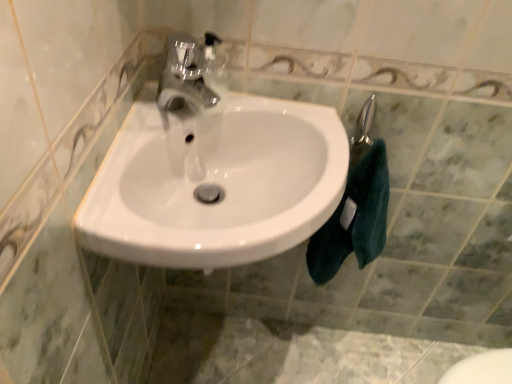
What is the approximate width of white glossy sink at center?

The width of white glossy sink at center is 16.95 inches.

The height and width of the screenshot is (384, 512). Find the location of `white glossy sink at center`. white glossy sink at center is located at coordinates (213, 172).

In order to face white glossy sink at center, should I rotate leftwards or rightwards?

Turn left by 2.709 degrees to look at white glossy sink at center.

The height and width of the screenshot is (384, 512). What do you see at coordinates (213, 172) in the screenshot?
I see `white glossy sink at center` at bounding box center [213, 172].

What do you see at coordinates (354, 218) in the screenshot? The width and height of the screenshot is (512, 384). I see `dark teal towel at right` at bounding box center [354, 218].

In order to click on dark teal towel at right in this screenshot , I will do `click(354, 218)`.

Find the location of a particular element. The width and height of the screenshot is (512, 384). white glossy sink at center is located at coordinates (213, 172).

Which is more to the left, dark teal towel at right or white glossy sink at center?

white glossy sink at center is more to the left.

Based on the photo, relative to white glossy sink at center, is dark teal towel at right in front or behind?

Visually, dark teal towel at right is located behind white glossy sink at center.

Between point (356, 211) and point (172, 115), which one is positioned in front?

The point (172, 115) is in front.

From the image's perspective, is dark teal towel at right on white glossy sink at center?

No, from the image's perspective, dark teal towel at right is not over white glossy sink at center.

From a real-world perspective, who is located lower, dark teal towel at right or white glossy sink at center?

In real-world perspective, dark teal towel at right is lower.

Which object is thinner, dark teal towel at right or white glossy sink at center?

dark teal towel at right.

Can you confirm if dark teal towel at right is taller than white glossy sink at center?

Yes, dark teal towel at right is taller than white glossy sink at center.

Which of these two, dark teal towel at right or white glossy sink at center, is bigger?

With larger size is white glossy sink at center.

Is dark teal towel at right completely or partially outside of white glossy sink at center?

→ Yes, dark teal towel at right is outside of white glossy sink at center.

Are dark teal towel at right and white glossy sink at center beside each other?

dark teal towel at right and white glossy sink at center are not in contact.

Is dark teal towel at right oriented towards white glossy sink at center?

No, dark teal towel at right does not turn towards white glossy sink at center.

How different are the orientations of dark teal towel at right and white glossy sink at center in degrees?

5.55 degrees separate the facing orientations of dark teal towel at right and white glossy sink at center.

How far apart are dark teal towel at right and white glossy sink at center?

dark teal towel at right and white glossy sink at center are 12.13 inches apart from each other.

You are a GUI agent. You are given a task and a screenshot of the screen. Output one action in this format:
    pyautogui.click(x=<x>, y=<y>)
    Task: Click on the sink that is above the dark teal towel at right (from the image's perspective)
    The image size is (512, 384).
    Given the screenshot: What is the action you would take?
    pyautogui.click(x=213, y=172)

Can you confirm if white glossy sink at center is positioned to the right of dark teal towel at right?

In fact, white glossy sink at center is to the left of dark teal towel at right.

Is white glossy sink at center in front of or behind dark teal towel at right in the image?

white glossy sink at center is in front of dark teal towel at right.

Considering the positions of points (168, 228) and (335, 210), is point (168, 228) closer to camera compared to point (335, 210)?

Yes, point (168, 228) is closer to viewer.

From the image's perspective, is white glossy sink at center located above or below dark teal towel at right?

Based on their image positions, white glossy sink at center is located above dark teal towel at right.

From a real-world perspective, between white glossy sink at center and dark teal towel at right, who is vertically lower?

dark teal towel at right, from a real-world perspective.

Can you confirm if white glossy sink at center is thinner than dark teal towel at right?

No, white glossy sink at center is not thinner than dark teal towel at right.

Which of these two, white glossy sink at center or dark teal towel at right, stands shorter?

Standing shorter between the two is white glossy sink at center.

Is white glossy sink at center bigger or smaller than dark teal towel at right?

In the image, white glossy sink at center appears to be larger than dark teal towel at right.

Is dark teal towel at right completely or partially inside white glossy sink at center?

No, dark teal towel at right is not inside white glossy sink at center.

Is white glossy sink at center not close to dark teal towel at right?

No, white glossy sink at center is not far from dark teal towel at right.

Is white glossy sink at center oriented towards dark teal towel at right?

No, white glossy sink at center is not aimed at dark teal towel at right.

Identify the location of sink above the dark teal towel at right (from a real-world perspective). Image resolution: width=512 pixels, height=384 pixels. (213, 172).

This screenshot has height=384, width=512. Identify the location of sink on the left of dark teal towel at right. (213, 172).

Find the location of a particular element. This screenshot has height=384, width=512. bath towel that appears below the white glossy sink at center (from a real-world perspective) is located at coordinates (354, 218).